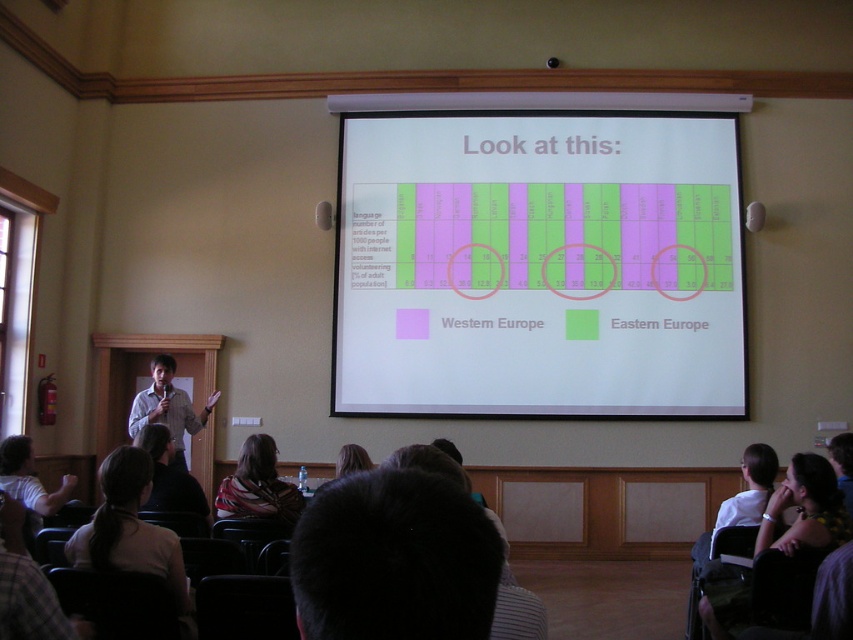
Does light beige fabric chair at lower left have a smaller size compared to dark brown leather jacket at lower left?

Indeed, light beige fabric chair at lower left has a smaller size compared to dark brown leather jacket at lower left.

Which is in front, point (149, 564) or point (192, 499)?

Point (149, 564) is more forward.

Locate an element on the screen. This screenshot has height=640, width=853. light beige fabric chair at lower left is located at coordinates (131, 532).

Is point (463, 525) positioned after point (154, 573)?

No, it is not.

Looking at this image, which is more to the right, dark hair at center or light beige fabric chair at lower left?

dark hair at center

You are a GUI agent. You are given a task and a screenshot of the screen. Output one action in this format:
    pyautogui.click(x=<x>, y=<y>)
    Task: Click on the dark hair at center
    
    Given the screenshot: What is the action you would take?
    coord(393,560)

Does dark hair at lower right have a lesser width compared to light brown hair at lower left?

In fact, dark hair at lower right might be wider than light brown hair at lower left.

Is point (761, 515) more distant than point (16, 464)?

No.

Between point (820, 531) and point (67, 488), which one is positioned behind?

Positioned behind is point (67, 488).

This screenshot has width=853, height=640. In order to click on dark hair at lower right in this screenshot , I will do `click(805, 509)`.